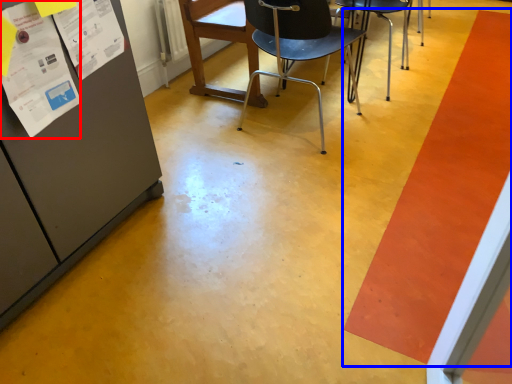
Question: Which object appears closest to the camera in this image, poster (highlighted by a red box) or strip (highlighted by a blue box)?

Choices:
 (A) poster
 (B) strip

Answer: (A)